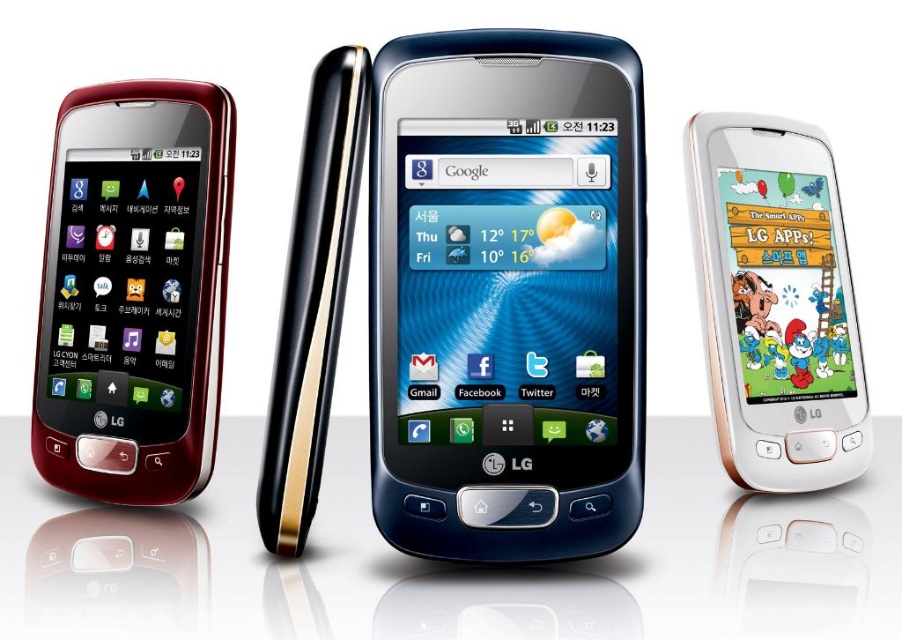
Question: Which of these objects is positioned closest to the satin black phone at center?

Choices:
 (A) white glossy phone at right
 (B) matte black phone at left

Answer: (A)

Question: Which object is farther from the camera taking this photo?

Choices:
 (A) matte black phone at left
 (B) satin black phone at center
 (C) white glossy phone at right

Answer: (C)

Question: Does matte black phone at left come behind white glossy phone at right?

Choices:
 (A) no
 (B) yes

Answer: (A)

Question: Can you confirm if matte black phone at left is positioned below white glossy phone at right?

Choices:
 (A) yes
 (B) no

Answer: (B)

Question: Among these points, which one is farthest from the camera?

Choices:
 (A) (126, 410)
 (B) (528, 170)
 (C) (735, 420)

Answer: (C)

Question: Can you confirm if satin black phone at center is smaller than white glossy phone at right?

Choices:
 (A) no
 (B) yes

Answer: (B)